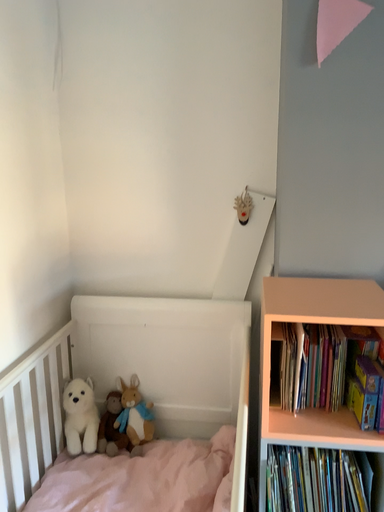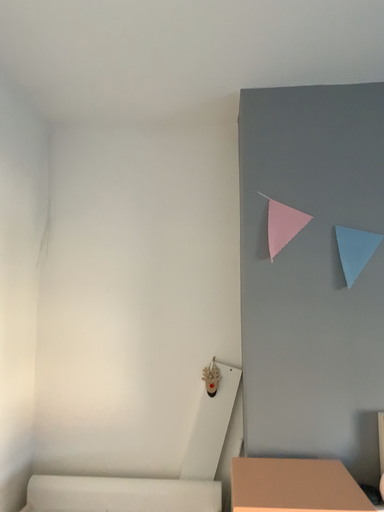
Question: How did the camera likely rotate when shooting the video?

Choices:
 (A) rotated downward
 (B) rotated upward

Answer: (B)